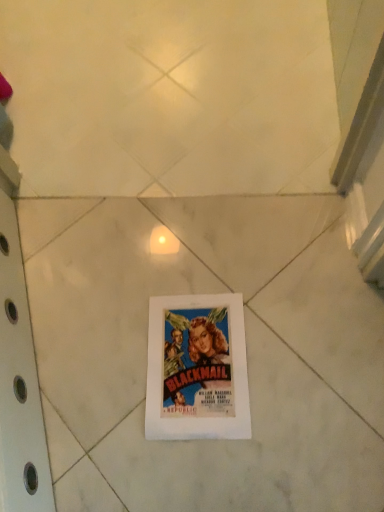
You are a GUI agent. You are given a task and a screenshot of the screen. Output one action in this format:
    pyautogui.click(x=<x>, y=<y>)
    Task: Click on the vacant area to the left of white paper at center
    
    Given the screenshot: What is the action you would take?
    pyautogui.click(x=99, y=388)